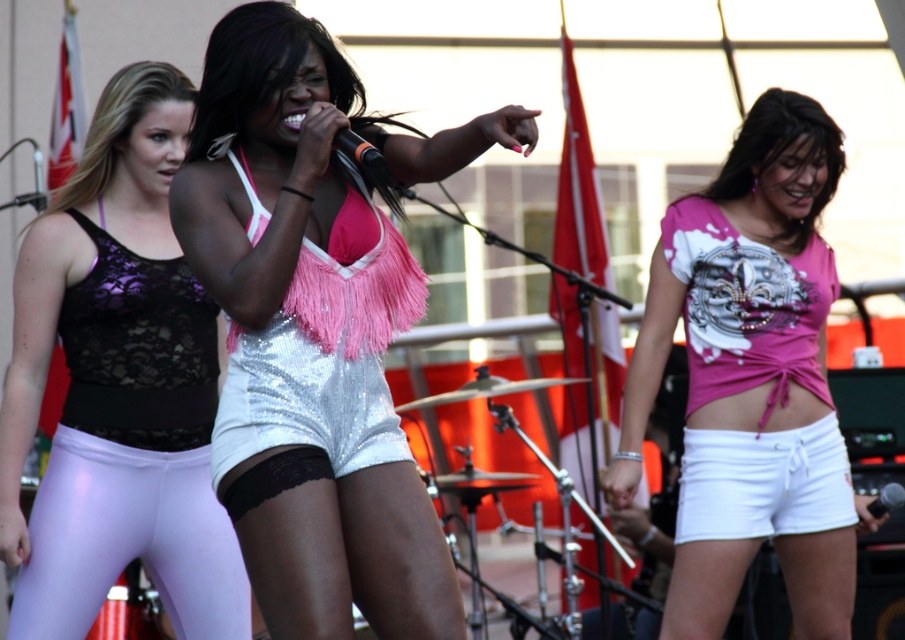
Can you confirm if shiny purple leggings at left is positioned above pink sequined bikini top at center?

Actually, shiny purple leggings at left is below pink sequined bikini top at center.

You are a GUI agent. You are given a task and a screenshot of the screen. Output one action in this format:
    pyautogui.click(x=<x>, y=<y>)
    Task: Click on the shiny purple leggings at left
    
    Given the screenshot: What is the action you would take?
    pyautogui.click(x=129, y=540)

At what (x,y) coordinates should I click in order to perform the action: click on shiny purple leggings at left. Please return your answer as a coordinate pair (x, y). Looking at the image, I should click on (129, 540).

Who is more distant from viewer, (344,68) or (91,497)?

The point (91,497) is more distant.

Is point (434, 141) positioned before point (141, 536)?

Yes, point (434, 141) is in front of point (141, 536).

Between point (456, 138) and point (157, 515), which one is positioned behind?

The point (157, 515) is more distant.

Find the location of a particular element. sequined silver shorts at center is located at coordinates (294, 170).

Who is higher up, lavender shiny leggings at left or pink fabric top at center?

lavender shiny leggings at left

From the picture: Is lavender shiny leggings at left to the left of pink fabric top at center from the viewer's perspective?

Correct, you'll find lavender shiny leggings at left to the left of pink fabric top at center.

Where is `lavender shiny leggings at left`? The image size is (905, 640). lavender shiny leggings at left is located at coordinates (118, 387).

Identify the location of lavender shiny leggings at left. (118, 387).